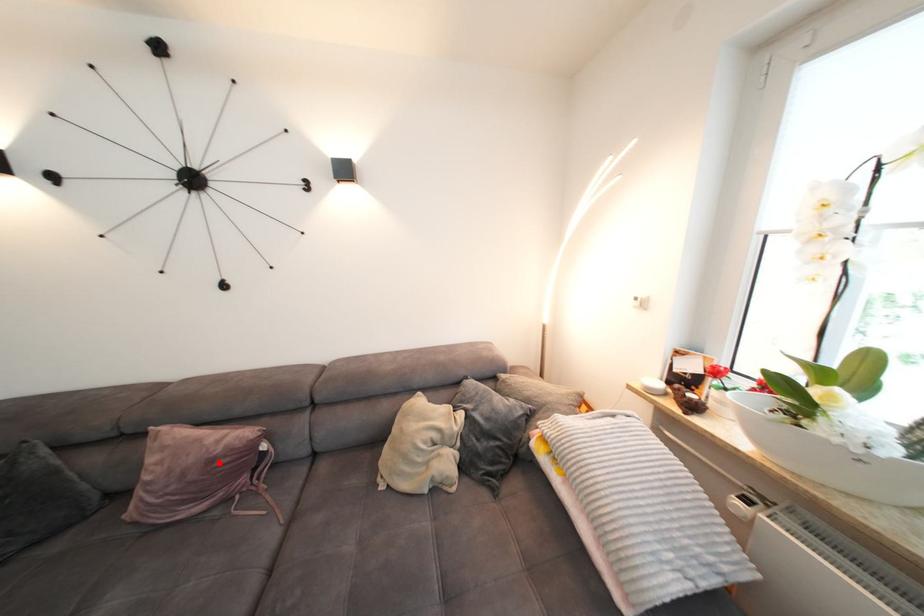
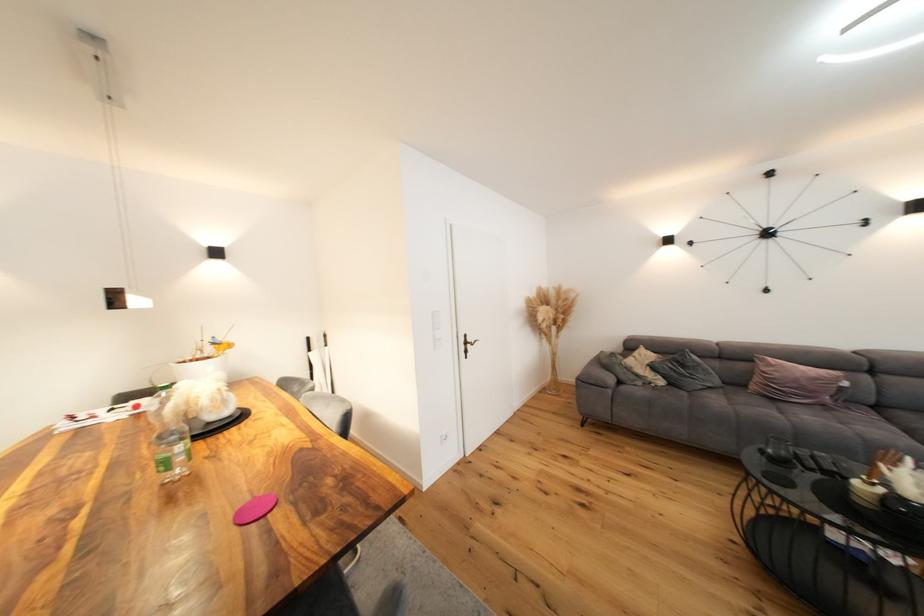
The point at the highlighted location is marked in the first image. Where is the corresponding point in the second image?

(822, 381)